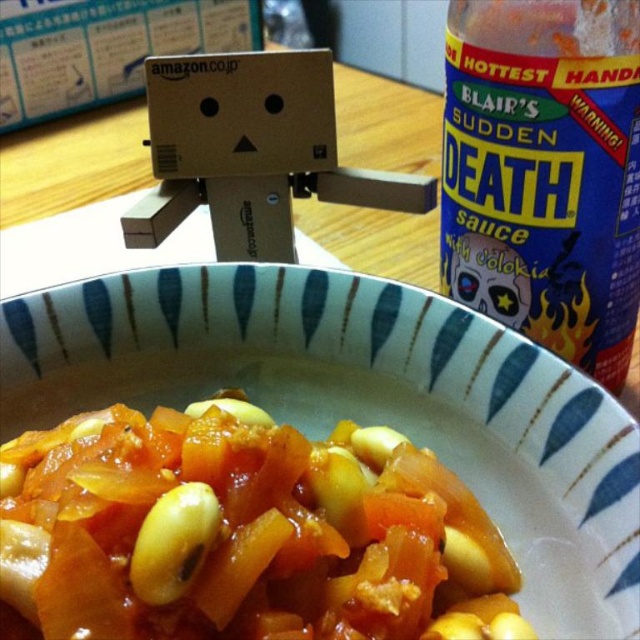
In the scene shown: Does yellow matte beans at center appear under yellow matte bean at center?

No, yellow matte beans at center is not below yellow matte bean at center.

Does point (120, 582) lie behind point (189, 536)?

That is True.

At what (x,y) coordinates should I click in order to perform the action: click on yellow matte beans at center. Please return your answer as a coordinate pair (x, y). The width and height of the screenshot is (640, 640). Looking at the image, I should click on (243, 532).

Between blue plastic bottle at upper right and yellow matte bean at center, which one has less height?

With less height is yellow matte bean at center.

Between point (452, 19) and point (132, 548), which one is positioned behind?

The point (452, 19) is behind.

This screenshot has width=640, height=640. What do you see at coordinates (545, 172) in the screenshot? I see `blue plastic bottle at upper right` at bounding box center [545, 172].

Identify the location of blue plastic bottle at upper right. (545, 172).

Who is more distant from viewer, (x=64, y=499) or (x=456, y=1)?

The point (x=456, y=1) is more distant.

Between yellow matte beans at center and blue plastic bottle at upper right, which one has more height?

blue plastic bottle at upper right is taller.

What are the coordinates of `yellow matte beans at center` in the screenshot? It's located at tap(243, 532).

Where is `yellow matte beans at center`? The image size is (640, 640). yellow matte beans at center is located at coordinates (243, 532).